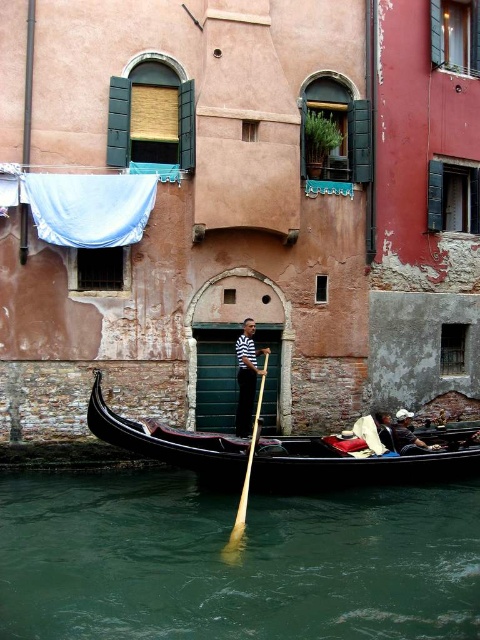
You are a tourist standing on the canal bridge and see the green liquid water at lower center and the striped cotton shirt at center. Which object is located below the other?

The green liquid water at lower center is positioned under striped cotton shirt at center, so the green liquid water at lower center is below the striped cotton shirt at center.

You are standing on a bridge overlooking the canal and see the black polished wood canoe at lower center and the dark blue fabric at lower right. Which object is positioned more to the left side of the canal?

The black polished wood canoe at lower center is positioned more to the left side of the canal than the dark blue fabric at lower right.

You are standing on the canal bridge and see the black polished wood canoe at lower center. What is the object located at point (354,465)?

The object located at point (354,465) is the black polished wood canoe at lower center.